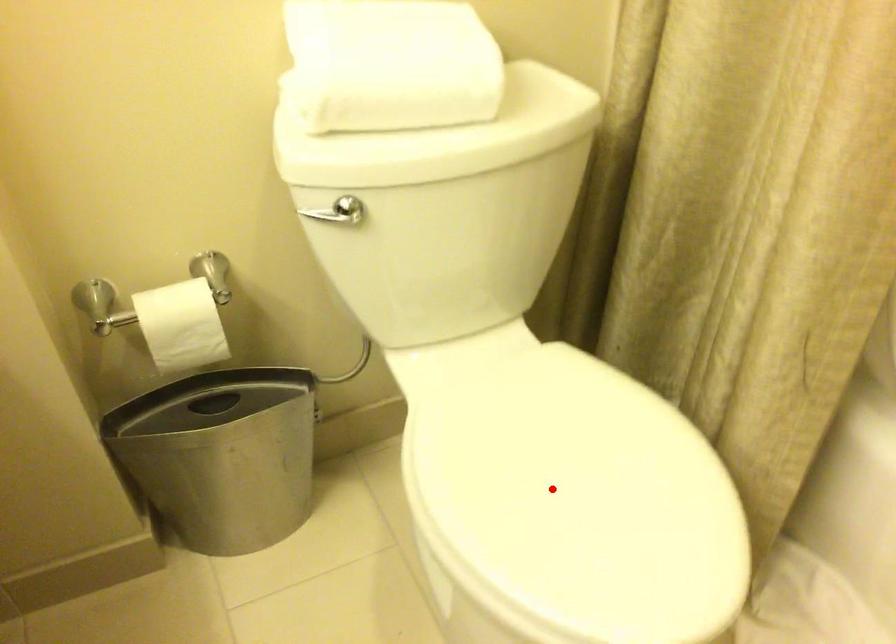
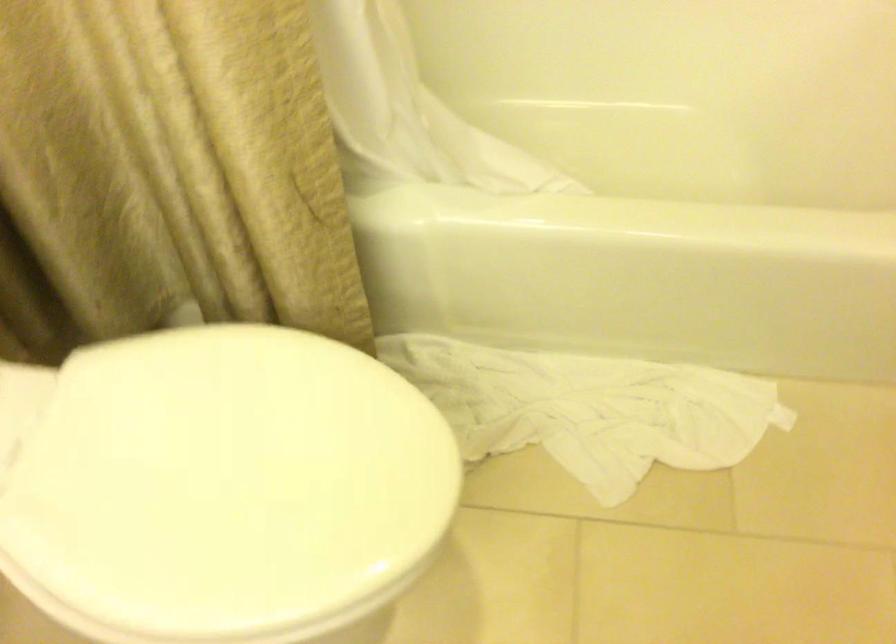
Question: I am providing you with two images of the same scene from different viewpoints. A red point is shown in image1. For the corresponding object point in image2, is it positioned nearer or farther from the camera?

Choices:
 (A) Nearer
 (B) Farther

Answer: (A)